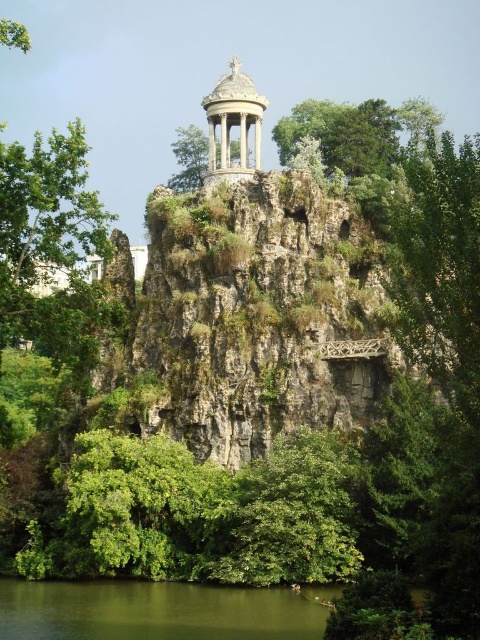
You are a hiker standing at the base of the rocky outcrop and want to take a photo of the green liquid water at lower center and the green leafy tree at upper center. Which object will appear larger in your photo?

The green liquid water at lower center will appear larger in the photo because it is closer to the camera than the green leafy tree at upper center.

You are standing at the base of the rocky outcrop and see the point marked at coordinates [158,611]. What is located at that point?

The point at coordinates [158,611] marks green liquid water at lower center.